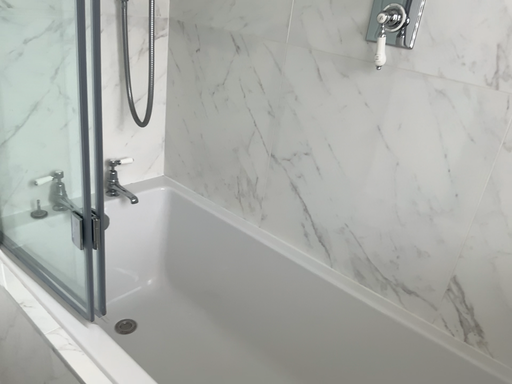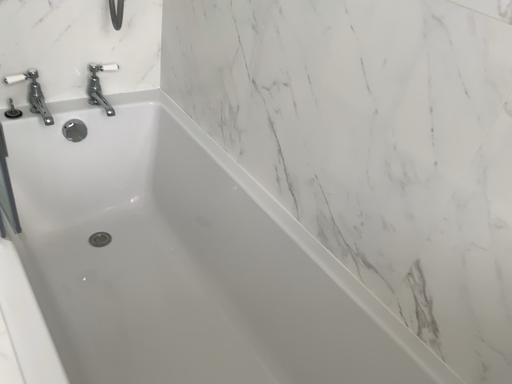
Question: Which way did the camera rotate in the video?

Choices:
 (A) rotated left
 (B) rotated right

Answer: (A)